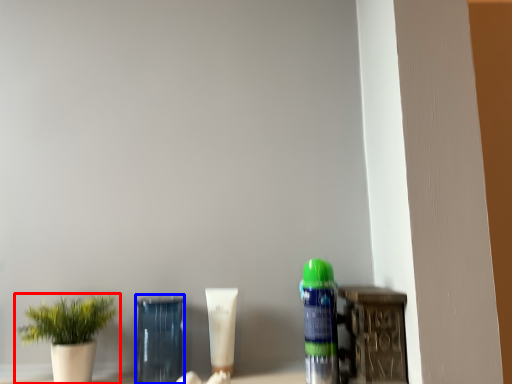
Question: Among these objects, which one is nearest to the camera, houseplant (highlighted by a red box) or glass vase (highlighted by a blue box)?

Choices:
 (A) houseplant
 (B) glass vase

Answer: (A)